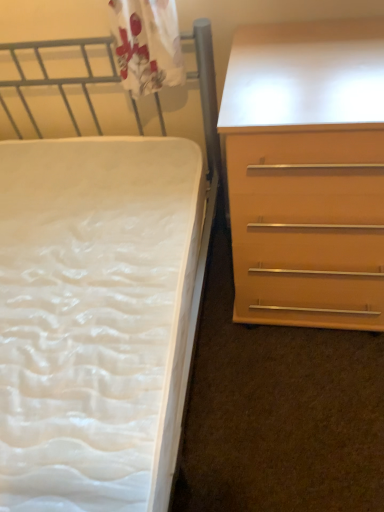
Question: Based on their positions, is white textured mattress at left located to the left or right of light brown wood chest of drawers at right?

Choices:
 (A) left
 (B) right

Answer: (A)

Question: From the image's perspective, is white textured mattress at left above or below light brown wood chest of drawers at right?

Choices:
 (A) below
 (B) above

Answer: (A)

Question: Considering the positions of point (147, 224) and point (236, 54), is point (147, 224) closer or farther from the camera than point (236, 54)?

Choices:
 (A) farther
 (B) closer

Answer: (A)

Question: Do you think light brown wood chest of drawers at right is within white textured mattress at left, or outside of it?

Choices:
 (A) inside
 (B) outside

Answer: (B)

Question: From the image's perspective, relative to white textured mattress at left, is light brown wood chest of drawers at right above or below?

Choices:
 (A) above
 (B) below

Answer: (A)

Question: In terms of width, does light brown wood chest of drawers at right look wider or thinner when compared to white textured mattress at left?

Choices:
 (A) thin
 (B) wide

Answer: (A)

Question: In terms of height, does light brown wood chest of drawers at right look taller or shorter compared to white textured mattress at left?

Choices:
 (A) tall
 (B) short

Answer: (B)